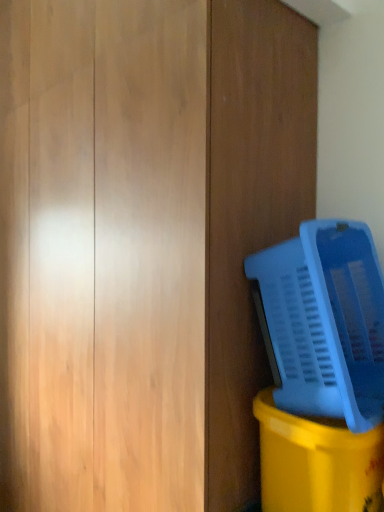
Identify the location of blue plastic basket at right. (326, 321).

The width and height of the screenshot is (384, 512). What do you see at coordinates (326, 321) in the screenshot? I see `blue plastic basket at right` at bounding box center [326, 321].

What do you see at coordinates (317, 462) in the screenshot?
I see `matte plastic basket at lower right` at bounding box center [317, 462].

The height and width of the screenshot is (512, 384). In order to click on matte plastic basket at lower right in this screenshot , I will do `click(317, 462)`.

What are the coordinates of `blue plastic basket at right` in the screenshot? It's located at (326, 321).

Based on the photo, can you confirm if matte plastic basket at lower right is positioned to the left of blue plastic basket at right?

In fact, matte plastic basket at lower right is to the right of blue plastic basket at right.

Does matte plastic basket at lower right lie behind blue plastic basket at right?

Yes, matte plastic basket at lower right is further from the camera.

Which is behind, point (339, 497) or point (303, 403)?

Positioned behind is point (303, 403).

From the image's perspective, between matte plastic basket at lower right and blue plastic basket at right, which one is located above?

From the image's view, blue plastic basket at right is above.

Looking at this image, from a real-world perspective, which is physically below, matte plastic basket at lower right or blue plastic basket at right?

In real-world perspective, matte plastic basket at lower right is lower.

Between matte plastic basket at lower right and blue plastic basket at right, which one has larger width?

blue plastic basket at right.

Considering the sizes of objects matte plastic basket at lower right and blue plastic basket at right in the image provided, who is shorter, matte plastic basket at lower right or blue plastic basket at right?

matte plastic basket at lower right is shorter.

Between matte plastic basket at lower right and blue plastic basket at right, which one has larger size?

Bigger between the two is blue plastic basket at right.

Would you say blue plastic basket at right is part of matte plastic basket at lower right's contents?

No, blue plastic basket at right is located outside of matte plastic basket at lower right.

Is matte plastic basket at lower right with blue plastic basket at right?

No, matte plastic basket at lower right is not next to blue plastic basket at right.

Consider the image. Is blue plastic basket at right at the back of matte plastic basket at lower right?

matte plastic basket at lower right is not turned away from blue plastic basket at right.

Can you tell me how much matte plastic basket at lower right and blue plastic basket at right differ in facing direction?

The angle between the facing direction of matte plastic basket at lower right and the facing direction of blue plastic basket at right is 0.28 degrees.

This screenshot has height=512, width=384. There is a matte plastic basket at lower right. In order to click on water cooler above it (from a real-world perspective) in this screenshot , I will do `click(326, 321)`.

Would you say blue plastic basket at right is to the left or to the right of matte plastic basket at lower right in the picture?

Based on their positions, blue plastic basket at right is located to the left of matte plastic basket at lower right.

Which is in front, blue plastic basket at right or matte plastic basket at lower right?

blue plastic basket at right is more forward.

Is point (300, 374) in front of point (345, 441)?

That is False.

From the image's perspective, is blue plastic basket at right above or below matte plastic basket at lower right?

From the image's perspective, blue plastic basket at right appears above matte plastic basket at lower right.

From a real-world perspective, is blue plastic basket at right physically below matte plastic basket at lower right?

No, from a real-world perspective, blue plastic basket at right is not below matte plastic basket at lower right.

Considering the relative sizes of blue plastic basket at right and matte plastic basket at lower right in the image provided, is blue plastic basket at right wider than matte plastic basket at lower right?

Yes, blue plastic basket at right is wider than matte plastic basket at lower right.

In terms of height, does blue plastic basket at right look taller or shorter compared to matte plastic basket at lower right?

Considering their sizes, blue plastic basket at right has more height than matte plastic basket at lower right.

Can you confirm if blue plastic basket at right is smaller than matte plastic basket at lower right?

Actually, blue plastic basket at right might be larger than matte plastic basket at lower right.

Is matte plastic basket at lower right inside blue plastic basket at right?

Actually, matte plastic basket at lower right is outside blue plastic basket at right.

Is blue plastic basket at right far away from matte plastic basket at lower right?

No.

Is matte plastic basket at lower right at the back of blue plastic basket at right?

That's not correct — blue plastic basket at right is not looking away from matte plastic basket at lower right.

Can you tell me how much blue plastic basket at right and matte plastic basket at lower right differ in facing direction?

The facing directions of blue plastic basket at right and matte plastic basket at lower right are 0.28 degrees apart.

Measure the distance from blue plastic basket at right to matte plastic basket at lower right.

blue plastic basket at right and matte plastic basket at lower right are 24.18 centimeters apart.

Identify the location of waste container located underneath the blue plastic basket at right (from a real-world perspective). (317, 462).

Identify the location of waste container that appears behind the blue plastic basket at right. The height and width of the screenshot is (512, 384). (317, 462).

Locate an element on the screen. Image resolution: width=384 pixels, height=512 pixels. waste container below the blue plastic basket at right (from a real-world perspective) is located at coordinates (317, 462).